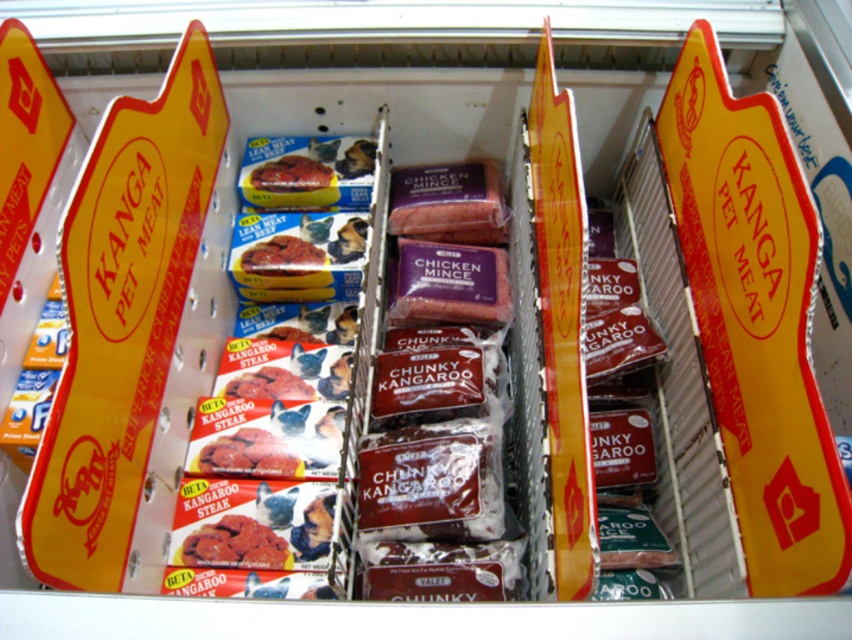
Is dark red raw meat at center smaller than matte red pet food at center?

Actually, dark red raw meat at center might be larger than matte red pet food at center.

How far apart are dark red raw meat at center and matte red pet food at center?

They are 22.49 inches apart.

Find the location of a particular element. dark red raw meat at center is located at coordinates (234, 545).